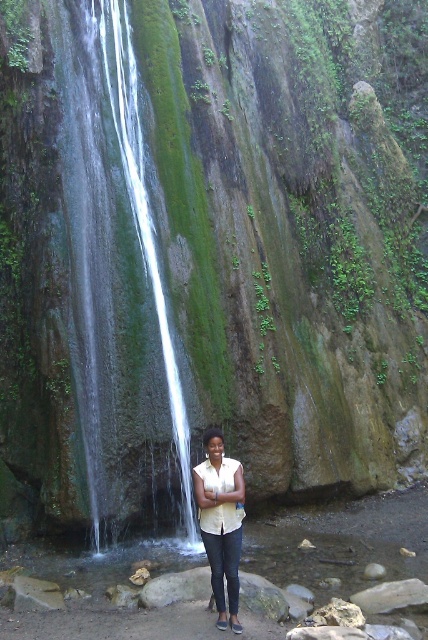
Question: Can you confirm if clear glass waterfall at center is thinner than matte yellow blouse at center?

Choices:
 (A) no
 (B) yes

Answer: (A)

Question: Which object is closer to the camera taking this photo?

Choices:
 (A) matte yellow blouse at center
 (B) clear glass waterfall at center

Answer: (A)

Question: Is clear glass waterfall at center smaller than matte yellow blouse at center?

Choices:
 (A) yes
 (B) no

Answer: (B)

Question: Can you confirm if clear glass waterfall at center is smaller than matte yellow blouse at center?

Choices:
 (A) no
 (B) yes

Answer: (A)

Question: Which point is closer to the camera taking this photo?

Choices:
 (A) [219, 525]
 (B) [118, 93]

Answer: (A)